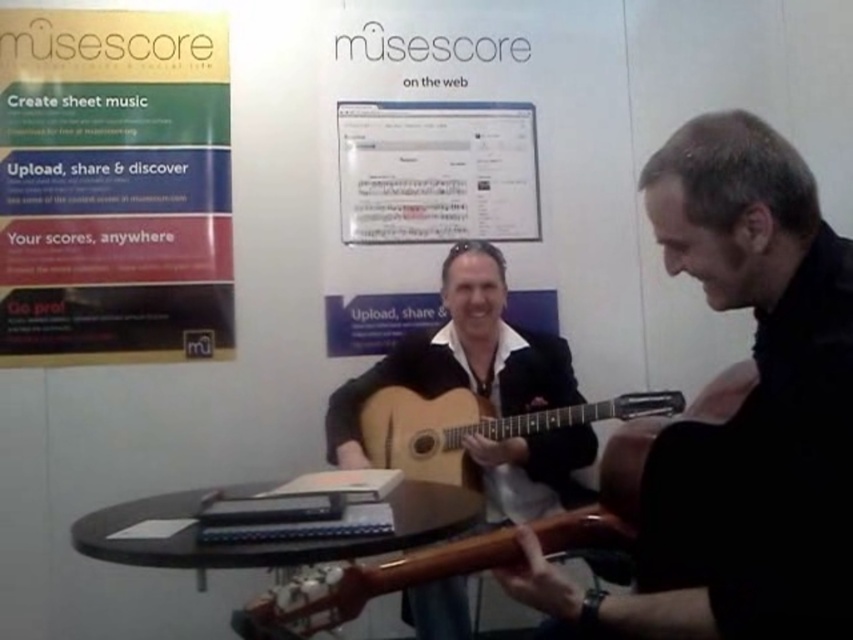
Which guitar is positioned higher in the image, the matte black guitar at center or the glossy wood guitar at center?

The matte black guitar at center is positioned higher than the glossy wood guitar at center in the image.

You are a photographer standing in front of the two posters, the matte gold poster at upper left and the white paper at center. You need to take a photo that captures both posters in the frame. The camera you are using has a maximum focus range of 80 centimeters. Will you be able to capture both posters in a single shot?

The matte gold poster at upper left and the white paper at center are 82.15 centimeters apart. Since the distance between them exceeds the camera s maximum focus range of 80 centimeters, you will not be able to capture both posters in a single shot.

You are an event organizer and need to adjust the stage setup. The white paper at center and the natural wood acoustic guitar at center are both important elements. Which object is placed higher in the image?

The white paper at center is positioned over the natural wood acoustic guitar at center, meaning it is placed higher in the image.